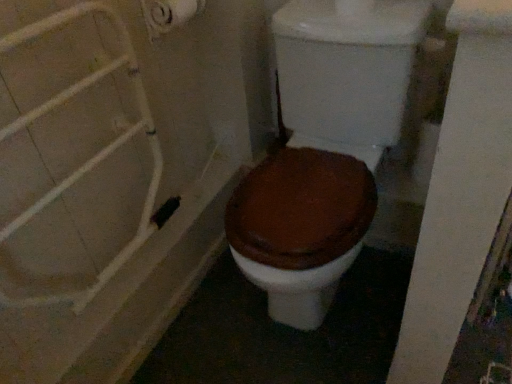
The height and width of the screenshot is (384, 512). What are the coordinates of `white matte shower door at left` in the screenshot? It's located at (97, 153).

What do you see at coordinates (169, 14) in the screenshot?
I see `white matte toilet paper at upper left` at bounding box center [169, 14].

Locate an element on the screen. The image size is (512, 384). white matte shower door at left is located at coordinates (97, 153).

Is brown matte toilet at center facing away from white matte shower door at left?

No.

Which is correct: brown matte toilet at center is inside white matte shower door at left, or outside of it?

brown matte toilet at center lies outside white matte shower door at left.

From the picture: Considering the relative sizes of brown matte toilet at center and white matte shower door at left in the image provided, is brown matte toilet at center bigger than white matte shower door at left?

Yes.

Between brown matte toilet at center and white matte shower door at left, which one is positioned behind?

brown matte toilet at center is behind.

What are the coordinates of `toilet paper behind the brown matte toilet at center` in the screenshot? It's located at (169, 14).

Can you confirm if white matte toilet paper at upper left is positioned to the left of brown matte toilet at center?

Correct, you'll find white matte toilet paper at upper left to the left of brown matte toilet at center.

Does white matte toilet paper at upper left have a greater height compared to brown matte toilet at center?

In fact, white matte toilet paper at upper left may be shorter than brown matte toilet at center.

Is point (180, 25) farther from viewer compared to point (292, 246)?

Yes, it is.

Which object is wider, white matte toilet paper at upper left or white matte shower door at left?

white matte toilet paper at upper left.

From the picture: From a real-world perspective, is white matte toilet paper at upper left below white matte shower door at left?

No.

How different are the orientations of white matte toilet paper at upper left and white matte shower door at left in degrees?

The facing directions of white matte toilet paper at upper left and white matte shower door at left are 0.53 degrees apart.

Is white matte shower door at left beside white matte toilet paper at upper left?

No, white matte shower door at left is not in contact with white matte toilet paper at upper left.

Is white matte shower door at left wider than white matte toilet paper at upper left?

No, white matte shower door at left is not wider than white matte toilet paper at upper left.

Is point (148, 216) in front of point (170, 17)?

No, it is behind (170, 17).

Is white matte shower door at left located outside white matte toilet paper at upper left?

Yes, white matte shower door at left is outside of white matte toilet paper at upper left.

What are the coordinates of `toilet on the right of white matte shower door at left` in the screenshot? It's located at (324, 149).

Can you confirm if white matte shower door at left is thinner than brown matte toilet at center?

Yes.

Which is less distant, (x=0, y=294) or (x=409, y=71)?

The point (x=0, y=294) is in front.

From the picture: From the image's perspective, between white matte shower door at left and brown matte toilet at center, which one is located above?

brown matte toilet at center is shown above in the image.

From the image's perspective, between brown matte toilet at center and white matte toilet paper at upper left, which one is located above?

white matte toilet paper at upper left appears higher in the image.

How many degrees apart are the facing directions of brown matte toilet at center and white matte toilet paper at upper left?

brown matte toilet at center and white matte toilet paper at upper left are facing 89.9 degrees away from each other.

Can you confirm if brown matte toilet at center is shorter than white matte toilet paper at upper left?

No.

Is brown matte toilet at center inside the boundaries of white matte toilet paper at upper left, or outside?

brown matte toilet at center exists outside the volume of white matte toilet paper at upper left.

Locate an element on the screen. toilet below the white matte shower door at left (from a real-world perspective) is located at coordinates (324, 149).

Where is `toilet paper that appears behind the brown matte toilet at center`? The height and width of the screenshot is (384, 512). toilet paper that appears behind the brown matte toilet at center is located at coordinates (169, 14).

Considering their positions, is brown matte toilet at center positioned closer to white matte shower door at left than white matte toilet paper at upper left?

Among the two, white matte toilet paper at upper left is located nearer to white matte shower door at left.

Based on the photo, which object lies further to the anchor point brown matte toilet at center, white matte toilet paper at upper left or white matte shower door at left?

white matte toilet paper at upper left lies further to brown matte toilet at center than the other object.

Estimate the real-world distances between objects in this image. Which object is further from brown matte toilet at center, white matte shower door at left or white matte toilet paper at upper left?

white matte toilet paper at upper left.

Looking at the image, which one is located closer to white matte shower door at left, white matte toilet paper at upper left or brown matte toilet at center?

white matte toilet paper at upper left is positioned closer to the anchor white matte shower door at left.

Looking at this image, based on their spatial positions, is white matte shower door at left or brown matte toilet at center further from white matte toilet paper at upper left?

brown matte toilet at center is further to white matte toilet paper at upper left.

Considering their positions, is brown matte toilet at center positioned further to white matte toilet paper at upper left than white matte shower door at left?

Based on the image, brown matte toilet at center appears to be further to white matte toilet paper at upper left.

Find the location of a particular element. This screenshot has width=512, height=384. toilet paper between white matte shower door at left and brown matte toilet at center in the horizontal direction is located at coordinates (169, 14).